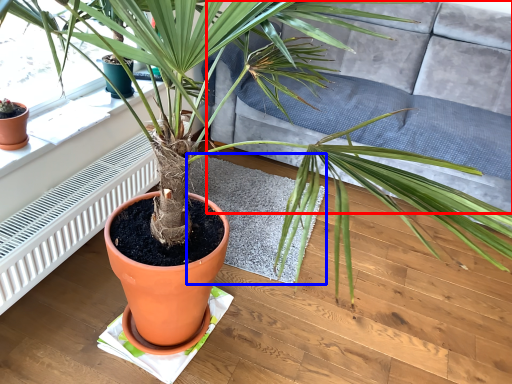
Question: Which of the following is the farthest to the observer, couch (highlighted by a red box) or mat (highlighted by a blue box)?

Choices:
 (A) couch
 (B) mat

Answer: (B)